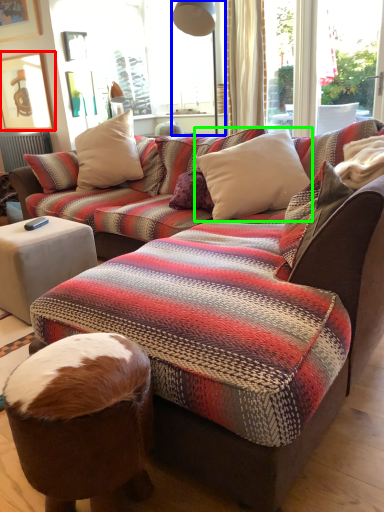
Question: Based on their relative distances, which object is farther from picture frame (highlighted by a red box)? Choose from lamp (highlighted by a blue box) and pillow (highlighted by a green box).

Choices:
 (A) lamp
 (B) pillow

Answer: (B)